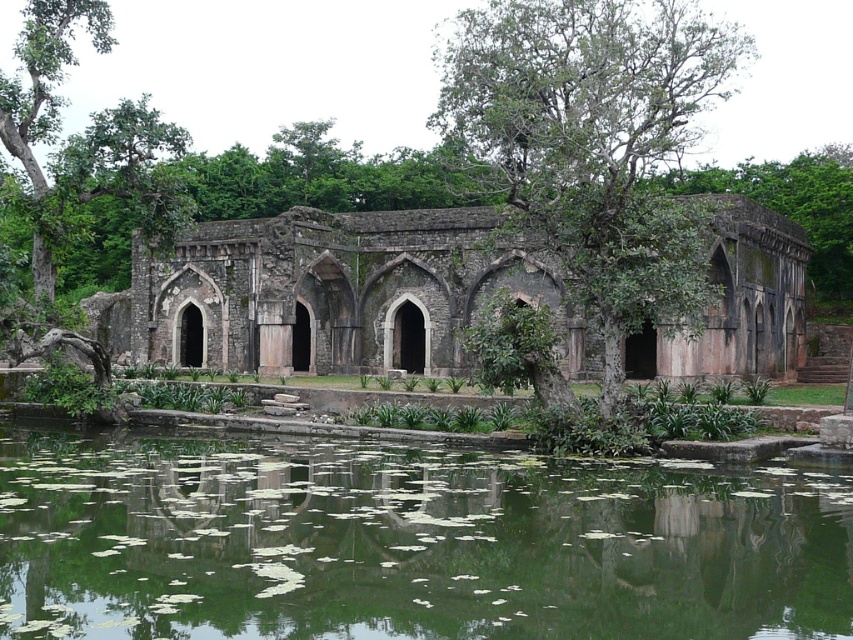
Consider the image. Which is more to the right, green reflective water at center or green leafy tree at center?

green leafy tree at center is more to the right.

Consider the image. Is green reflective water at center bigger than green leafy tree at center?

No, green reflective water at center is not bigger than green leafy tree at center.

Between point (495, 563) and point (601, 26), which one is positioned in front?

Positioned in front is point (495, 563).

At what (x,y) coordinates should I click in order to perform the action: click on green reflective water at center. Please return your answer as a coordinate pair (x, y). The width and height of the screenshot is (853, 640). Looking at the image, I should click on (405, 541).

Who is positioned more to the right, green leafy tree at center or rustic stone building at center?

green leafy tree at center is more to the right.

Does green leafy tree at center appear on the left side of rustic stone building at center?

Incorrect, green leafy tree at center is not on the left side of rustic stone building at center.

Measure the distance between green leafy tree at center and camera.

green leafy tree at center is 55.42 meters away from camera.

At what (x,y) coordinates should I click in order to perform the action: click on green leafy tree at center. Please return your answer as a coordinate pair (x, y). Image resolution: width=853 pixels, height=640 pixels. Looking at the image, I should click on (589, 182).

Does green reflective water at center appear under rustic stone building at center?

Yes.

Can you confirm if green reflective water at center is positioned to the right of rustic stone building at center?

No, green reflective water at center is not to the right of rustic stone building at center.

Identify the location of green reflective water at center. (405, 541).

Locate an element on the screen. green reflective water at center is located at coordinates (405, 541).